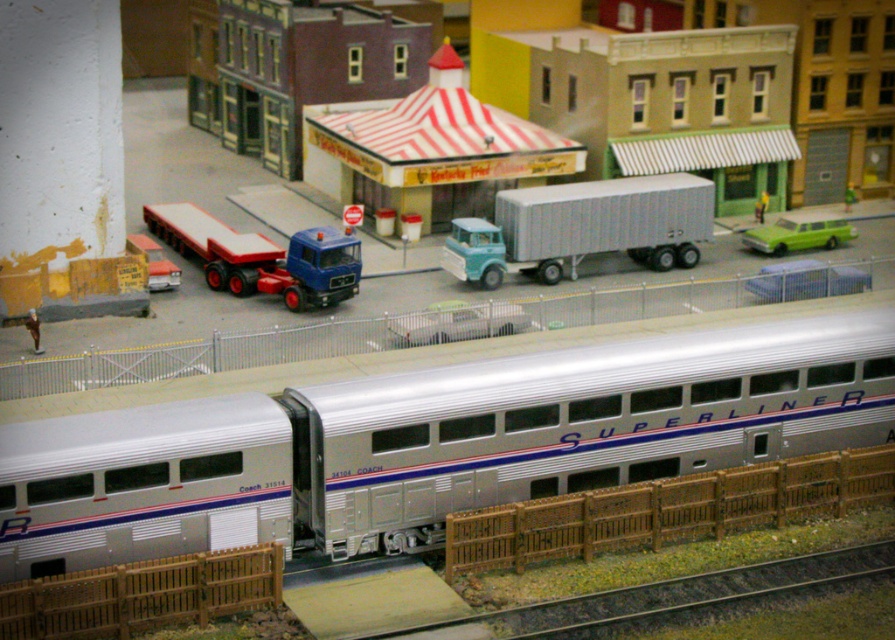
Question: Among these objects, which one is nearest to the camera?

Choices:
 (A) light blue metallic truck at center
 (B) metallic blue car at center

Answer: (B)

Question: In this image, where is silver metallic train car at center located relative to green matte station wagon at center-right?

Choices:
 (A) right
 (B) left

Answer: (B)

Question: Is metallic blue truck at center-left to the left of green matte station wagon at center-right from the viewer's perspective?

Choices:
 (A) no
 (B) yes

Answer: (B)

Question: Observing the image, what is the correct spatial positioning of light blue metallic truck at center in reference to metallic blue car at center?

Choices:
 (A) below
 (B) above

Answer: (B)

Question: Based on their relative distances, which object is nearer to the silver metallic train car at center?

Choices:
 (A) metallic silver train track at lower center
 (B) green matte station wagon at center-right
 (C) metallic silver car at center

Answer: (C)

Question: Based on their relative distances, which object is nearer to the metallic blue car at center?

Choices:
 (A) light blue metallic truck at center
 (B) silver metallic train car at center
 (C) metallic silver car at center
 (D) metallic silver train track at lower center

Answer: (A)